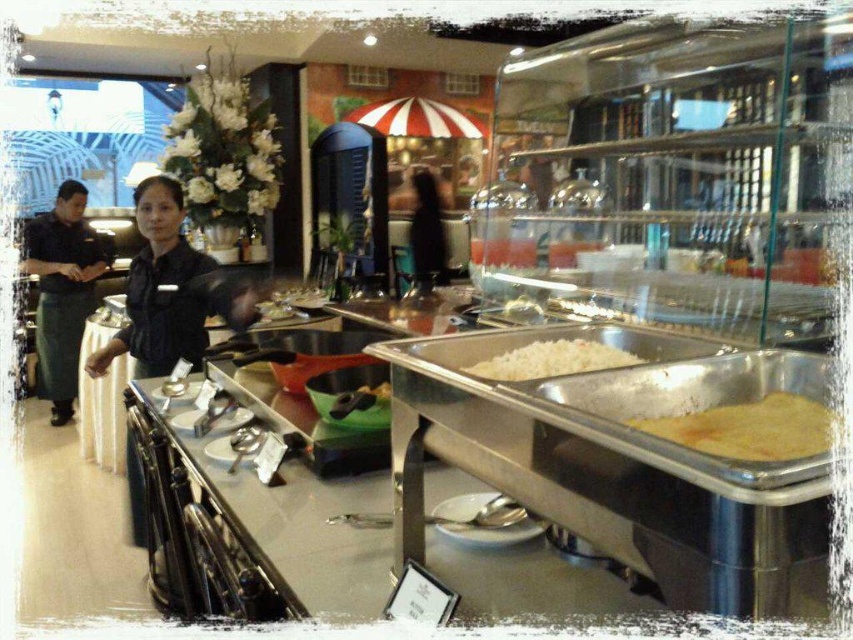
Question: Can you confirm if black uniform at left is bigger than white matte rice at center?

Choices:
 (A) no
 (B) yes

Answer: (B)

Question: Is the position of black uniform at left less distant than that of yellow matte pancake at right?

Choices:
 (A) yes
 (B) no

Answer: (B)

Question: Which point is closer to the camera taking this photo?

Choices:
 (A) (409, 248)
 (B) (572, 353)
 (C) (167, 368)
 (D) (828, 435)

Answer: (D)

Question: Which point is closer to the camera?

Choices:
 (A) (759, 413)
 (B) (190, 257)
 (C) (544, 346)

Answer: (A)

Question: Which object appears closest to the camera in this image?

Choices:
 (A) black fabric at center
 (B) black uniform at left
 (C) black uniform at center
 (D) white matte rice at center

Answer: (D)

Question: From the image, what is the correct spatial relationship of black uniform at center in relation to black uniform at left?

Choices:
 (A) below
 (B) above

Answer: (B)